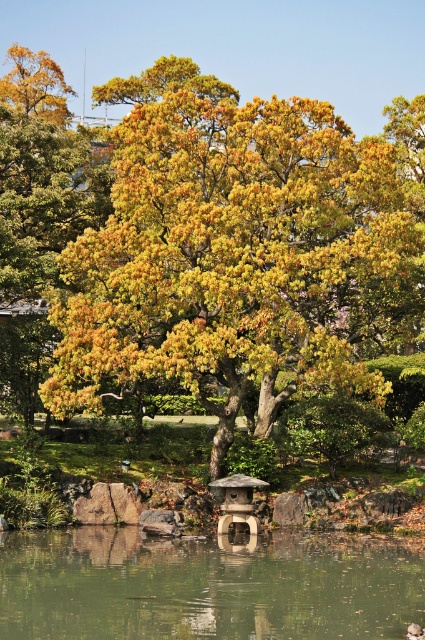
Question: In this image, where is yellow-green foliage at center located relative to beige stone gazebo at center?

Choices:
 (A) below
 (B) above

Answer: (B)

Question: Does yellow-green foliage at center have a lesser width compared to transparent glass water at center?

Choices:
 (A) no
 (B) yes

Answer: (A)

Question: Can you confirm if transparent glass water at center is positioned below beige stone gazebo at center?

Choices:
 (A) no
 (B) yes

Answer: (B)

Question: Which is farther from the transparent glass water at center?

Choices:
 (A) yellow-green foliage at center
 (B) beige stone gazebo at center

Answer: (A)

Question: Which point appears farthest from the camera in this image?

Choices:
 (A) (201, 620)
 (B) (401, 282)

Answer: (B)

Question: Among these objects, which one is nearest to the camera?

Choices:
 (A) transparent glass water at center
 (B) beige stone gazebo at center
 (C) yellow-green foliage at center

Answer: (A)